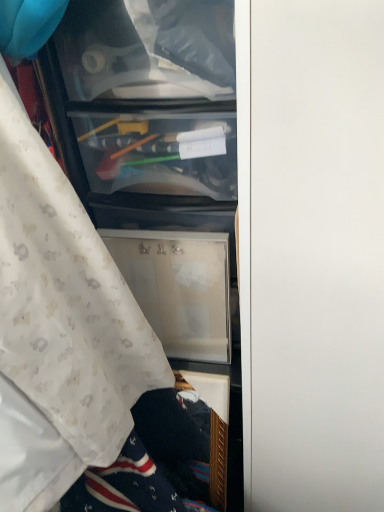
Question: Is white matte door at center taller or shorter than white textured fabric at left?

Choices:
 (A) short
 (B) tall

Answer: (B)

Question: Is white matte door at center to the left or to the right of white textured fabric at left in the image?

Choices:
 (A) left
 (B) right

Answer: (B)

Question: Is white matte door at center bigger or smaller than white textured fabric at left?

Choices:
 (A) big
 (B) small

Answer: (A)

Question: In terms of size, does white textured fabric at left appear bigger or smaller than white matte door at center?

Choices:
 (A) big
 (B) small

Answer: (B)

Question: From the image's perspective, is white textured fabric at left located above or below white matte door at center?

Choices:
 (A) above
 (B) below

Answer: (A)

Question: From a real-world perspective, is white textured fabric at left above or below white matte door at center?

Choices:
 (A) above
 (B) below

Answer: (A)

Question: Is white textured fabric at left inside the boundaries of white matte door at center, or outside?

Choices:
 (A) outside
 (B) inside

Answer: (A)